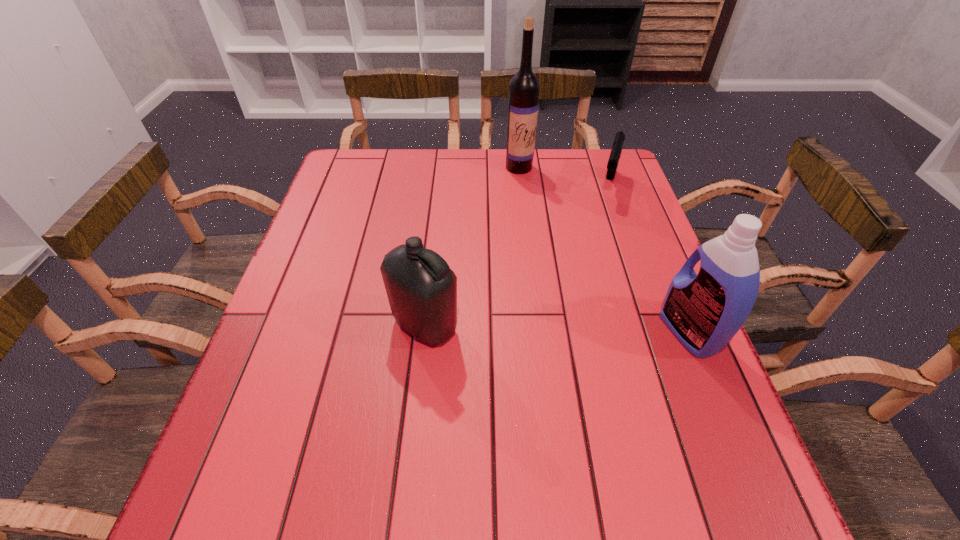
The width and height of the screenshot is (960, 540). I want to click on vacant area that lies between the second tallest object and the tallest object, so [x=604, y=249].

At what (x,y) coordinates should I click in order to perform the action: click on free area in between the pistol and the leftmost object. Please return your answer as a coordinate pair (x, y). The width and height of the screenshot is (960, 540). Looking at the image, I should click on (516, 255).

At what (x,y) coordinates should I click in order to perform the action: click on free point between the tallest object and the shortest object. Please return your answer as a coordinate pair (x, y). Looking at the image, I should click on (564, 177).

The height and width of the screenshot is (540, 960). I want to click on vacant space that's between the pistol and the second object from left to right, so click(564, 177).

Locate an element on the screen. Image resolution: width=960 pixels, height=540 pixels. empty space between the pistol and the third tallest object is located at coordinates (516, 255).

Select which object is the second closest to the tallest object. Please provide its 2D coordinates. Your answer should be formatted as a tuple, i.e. [(x, y)], where the tuple contains the x and y coordinates of a point satisfying the conditions above.

[(422, 289)]

Image resolution: width=960 pixels, height=540 pixels. What are the coordinates of `object that ranks as the third closest to the bottle` in the screenshot? It's located at (616, 151).

Find the location of a particular element. The height and width of the screenshot is (540, 960). vacant space that satisfies the following two spatial constraints: 1. on the front side of the second object from left to right; 2. on the right side of the shortest object is located at coordinates (521, 186).

Identify the location of free space in the image that satisfies the following two spatial constraints: 1. on the front side of the third object from right to left; 2. on the left side of the shortest object. The width and height of the screenshot is (960, 540). (521, 186).

Find the location of `vacant space that satisfies the following two spatial constraints: 1. on the front side of the third shortest object; 2. on the right side of the bottle`. vacant space that satisfies the following two spatial constraints: 1. on the front side of the third shortest object; 2. on the right side of the bottle is located at coordinates (424, 332).